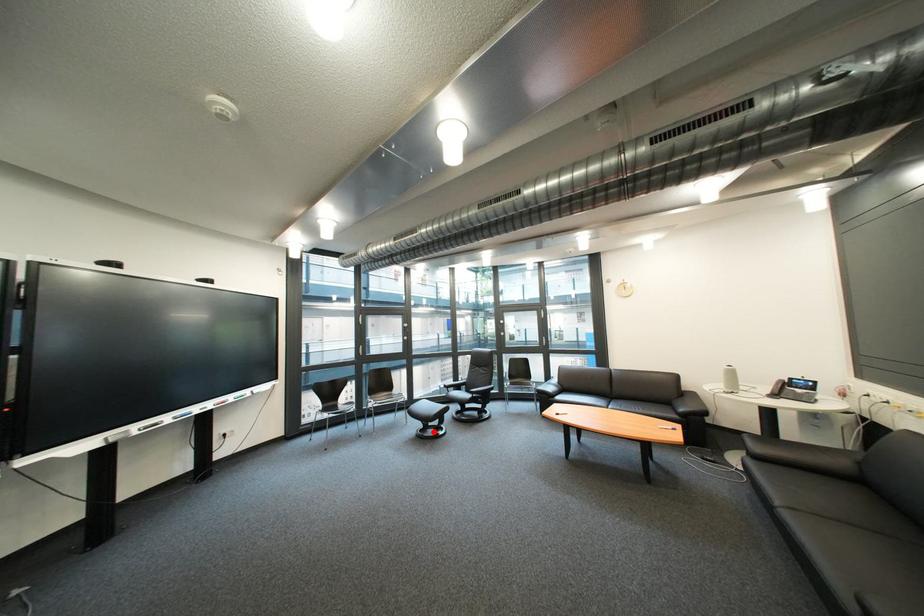
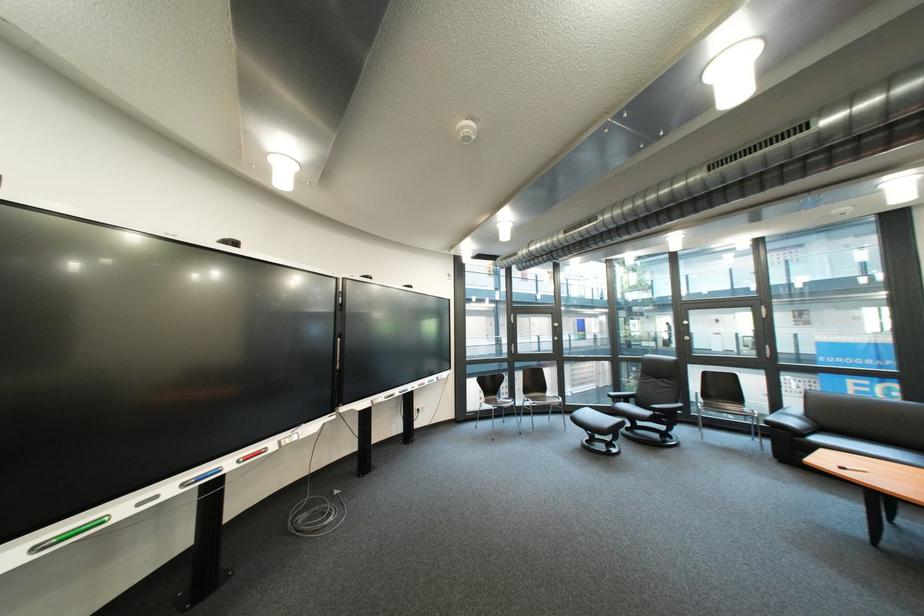
Question: I am providing you with two images of the same scene from different viewpoints. Image1 has a red point marked. In image2, the corresponding 3D location appears at what relative position? Reply with the corresponding letter.

Choices:
 (A) Closer
 (B) Farther

Answer: (A)